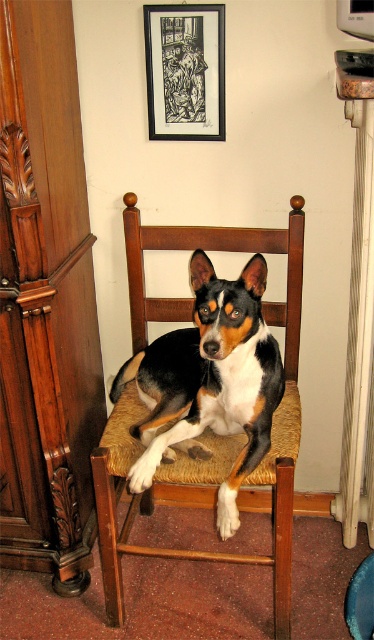
You are a photographer standing in front of the wooden chair with the dog. You want to take a picture of the dog. Where should you position your camera to capture the dog at its exact position? Please provide the coordinates in the format of a point like point (213, 380).

The black and white fur dog at center is located at point (213, 380), so you should position your camera at point (213, 380) to capture the dog at its exact position.

You are a delivery robot with a package that needs to be placed between the brushed wood cabinet at left and the black and white fur dog at center. The package is 40 centimeters wide. Will the space between them accommodate the package?

The space between the brushed wood cabinet at left and the black and white fur dog at center is 41.00 centimeters. Since the package is 40 centimeters wide, it will fit with 1 centimeter of space remaining.

You are standing in front of the chair where the dog is sitting. There are two points marked on the chair. One is at point coordinates point (x=48, y=44) and the other is at point coordinates point (x=188, y=35). Which point is closer to you?

Point (x=48, y=44) is closer to the viewer than point (x=188, y=35).